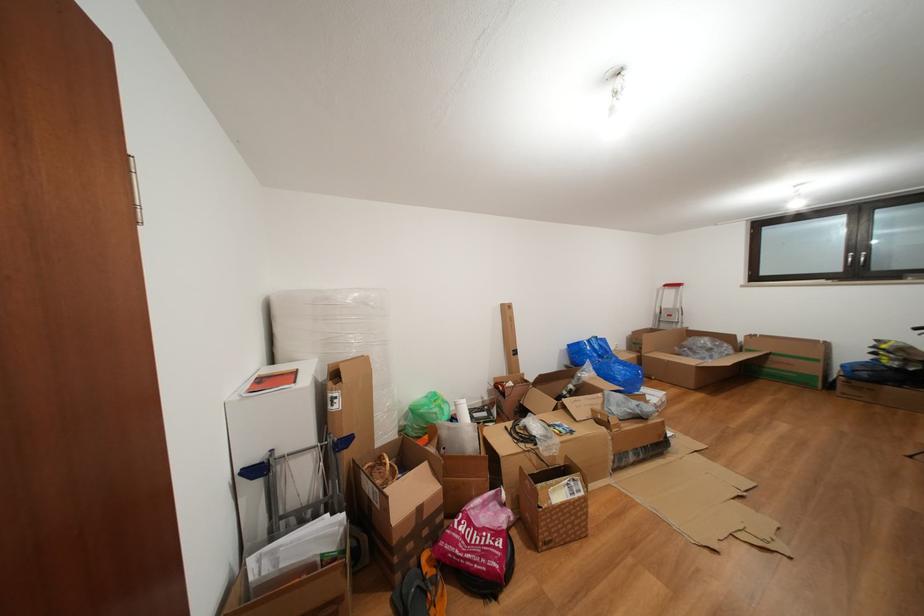
Which object does [426,413] point to?

It corresponds to the green plastic bag in the image.